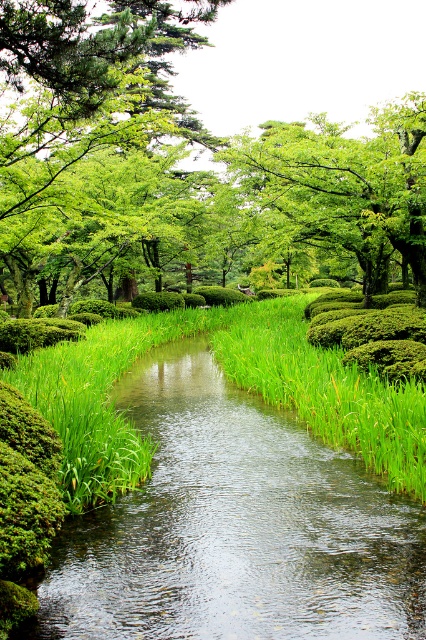
You are a photographer standing at the edge of the garden. You want to capture a clear photo of the green grassy stream at center without any obstructions. Considering your current position, is the stream within a 3 meter range from you?

The distance between you and the green grassy stream at center is 3.02 meters, which is slightly beyond the 3 meter range. Therefore, you are just out of range to capture it clearly without moving closer.

You are standing in the garden and want to cross the green grassy stream at center. Your backpack has a waterproof rating of 2.5 meters. Can you safely cross the stream with your backpack?

The green grassy stream at center is 3.02 meters away from the camera, which is wider than your backpacks 2.5 meter waterproof rating. Therefore, you should not cross the stream with your backpack as it may get damaged.

You are a gardener standing at the edge of the garden. You need to place a small decorative stone between the green grassy stream at center and the green leafy grass at center. Which one should you place the stone closer to in order to make it visible from where you are standing?

You should place the stone closer to the green grassy stream at center because it is closer to the viewer than the green leafy grass at center, making it more visible from your current position.